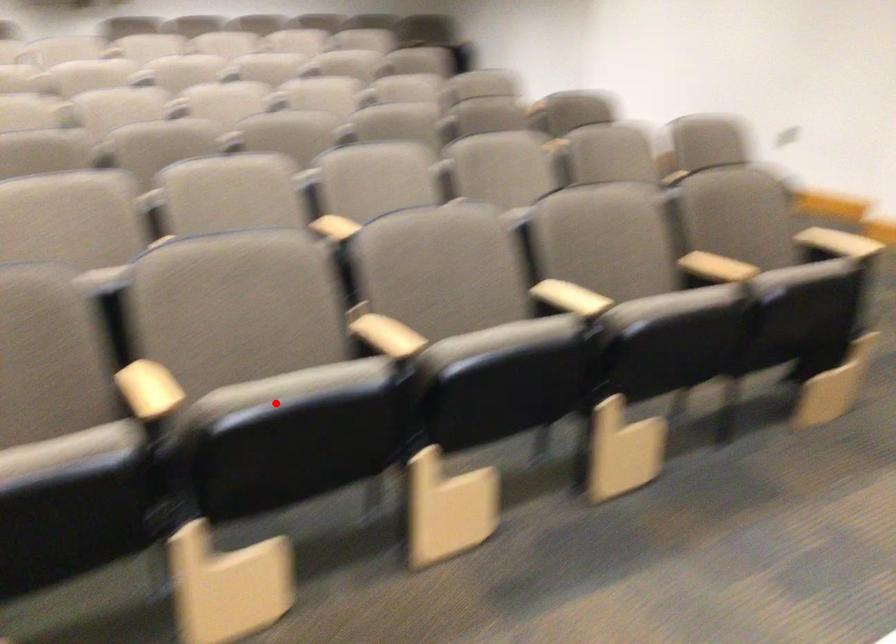
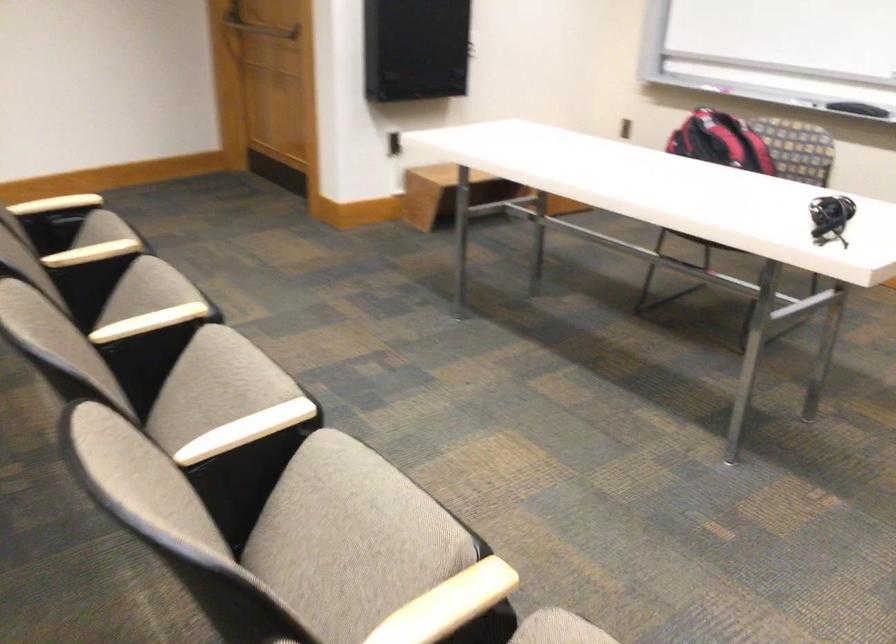
Question: I am providing you with two images of the same scene from different viewpoints. A red point is shown in image1. For the corresponding object point in image2, is it positioned nearer or farther from the camera?

Choices:
 (A) Nearer
 (B) Farther

Answer: (A)